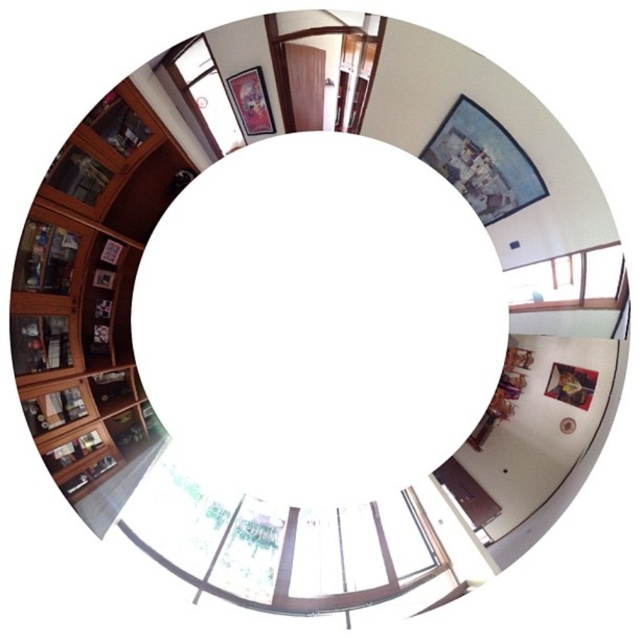
Question: Does matte wooden picture frame at upper center have a greater width compared to transparent glass window at upper left?

Choices:
 (A) yes
 (B) no

Answer: (A)

Question: Can you confirm if white matte circle at center is thinner than wooden picture frame at lower right?

Choices:
 (A) no
 (B) yes

Answer: (A)

Question: Which point appears closest to the camera in this image?

Choices:
 (A) (566, 424)
 (B) (419, 337)

Answer: (A)

Question: Which of the following is the closest to the observer?

Choices:
 (A) (234, 118)
 (B) (332, 472)

Answer: (A)

Question: Is matte wooden picture frame at upper center smaller than transparent glass window at upper right?

Choices:
 (A) yes
 (B) no

Answer: (B)

Question: Which of the following is the closest to the observer?

Choices:
 (A) matte black circle at lower right
 (B) transparent glass window at upper left
 (C) wooden picture frame at upper center

Answer: (A)